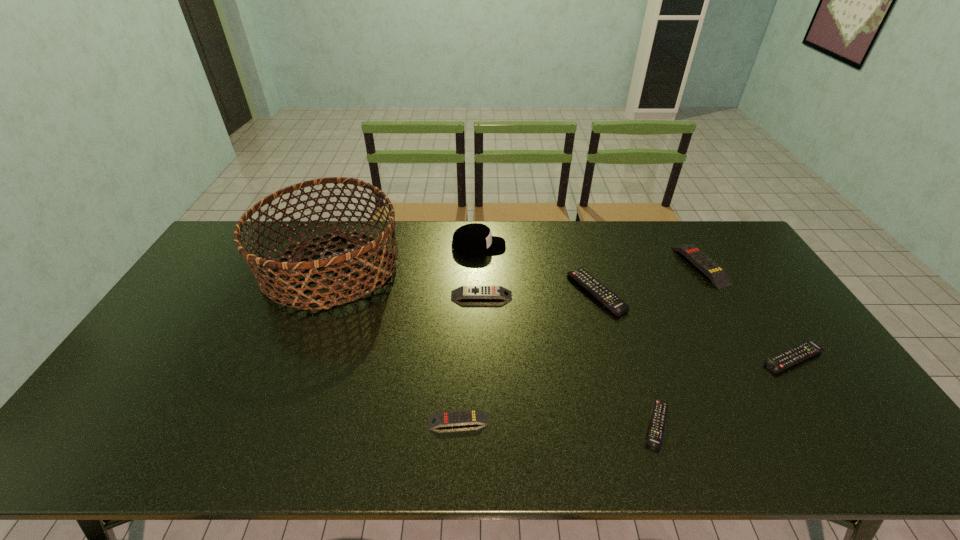
Find the location of `the tallest object`. the tallest object is located at coordinates (278, 287).

In order to click on the leftmost object in this screenshot , I will do `click(278, 287)`.

Where is `the second tallest object`? the second tallest object is located at coordinates [x=475, y=238].

Locate an element on the screen. The width and height of the screenshot is (960, 540). cap is located at coordinates (475, 238).

Identify the location of the biggest yellow remote control. (717, 275).

This screenshot has width=960, height=540. In order to click on the rightmost yellow remote control in this screenshot , I will do `click(717, 275)`.

Identify the location of the second biggest yellow remote control. (464, 292).

The height and width of the screenshot is (540, 960). I want to click on the farthest black remote control, so click(x=610, y=300).

Identify the location of the second nearest black remote control. The image size is (960, 540). (798, 353).

Locate an element on the screen. This screenshot has height=540, width=960. the second biggest black remote control is located at coordinates (798, 353).